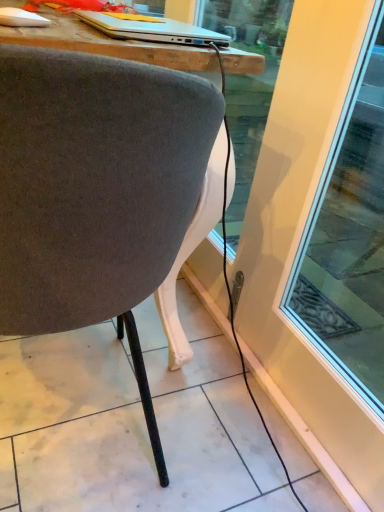
This screenshot has height=512, width=384. What do you see at coordinates (95, 190) in the screenshot?
I see `velvet gray chair at center` at bounding box center [95, 190].

In order to face velvet gray chair at center, should I rotate leftwards or rightwards?

You should look left and rotate roughly 14.360 degrees.

What is the approximate height of velvet gray chair at center?

It is 32.37 inches.

Find the location of `velvet gray chair at center`. velvet gray chair at center is located at coordinates (95, 190).

The width and height of the screenshot is (384, 512). What do you see at coordinates (151, 29) in the screenshot? I see `silver metallic laptop at upper center` at bounding box center [151, 29].

This screenshot has height=512, width=384. I want to click on silver metallic laptop at upper center, so click(x=151, y=29).

You are a GUI agent. You are given a task and a screenshot of the screen. Output one action in this format:
    pyautogui.click(x=<x>, y=<y>)
    Task: Click on the velvet gray chair at center
    
    Given the screenshot: What is the action you would take?
    pyautogui.click(x=95, y=190)

Is velvet gray chair at center to the right of silver metallic laptop at upper center from the viewer's perspective?

No, velvet gray chair at center is not to the right of silver metallic laptop at upper center.

Is velvet gray chair at center positioned in front of silver metallic laptop at upper center?

Yes, the depth of velvet gray chair at center is less than that of silver metallic laptop at upper center.

Between point (101, 146) and point (141, 21), which one is positioned in front?

Positioned in front is point (101, 146).

From the image's perspective, who appears lower, velvet gray chair at center or silver metallic laptop at upper center?

velvet gray chair at center is shown below in the image.

From a real-world perspective, which object stands above the other?

From a 3D spatial view, silver metallic laptop at upper center is above.

Looking at their sizes, would you say velvet gray chair at center is wider or thinner than silver metallic laptop at upper center?

In the image, velvet gray chair at center appears to be wider than silver metallic laptop at upper center.

Who is shorter, velvet gray chair at center or silver metallic laptop at upper center?

With less height is silver metallic laptop at upper center.

Which of these two, velvet gray chair at center or silver metallic laptop at upper center, is bigger?

With larger size is velvet gray chair at center.

Is velvet gray chair at center inside the boundaries of silver metallic laptop at upper center, or outside?

velvet gray chair at center is outside silver metallic laptop at upper center.

Is velvet gray chair at center not near silver metallic laptop at upper center?

velvet gray chair at center is actually quite close to silver metallic laptop at upper center.

Is velvet gray chair at center looking in the opposite direction of silver metallic laptop at upper center?

No, velvet gray chair at center is not facing away from silver metallic laptop at upper center.

At what (x,y) coordinates should I click in order to perform the action: click on laptop on the right of velvet gray chair at center. Please return your answer as a coordinate pair (x, y). This screenshot has width=384, height=512. Looking at the image, I should click on (151, 29).

Is silver metallic laptop at upper center to the left of velvet gray chair at center from the viewer's perspective?

In fact, silver metallic laptop at upper center is to the right of velvet gray chair at center.

Which is in front, silver metallic laptop at upper center or velvet gray chair at center?

velvet gray chair at center is more forward.

Which point is more distant from viewer, (137, 25) or (163, 216)?

Positioned behind is point (137, 25).

From the image's perspective, which is above, silver metallic laptop at upper center or velvet gray chair at center?

From the image's view, silver metallic laptop at upper center is above.

From a real-world perspective, which object stands above the other?

silver metallic laptop at upper center.

Is silver metallic laptop at upper center wider or thinner than velvet gray chair at center?

Considering their sizes, silver metallic laptop at upper center looks slimmer than velvet gray chair at center.

Who is taller, silver metallic laptop at upper center or velvet gray chair at center?

With more height is velvet gray chair at center.

Does silver metallic laptop at upper center have a smaller size compared to velvet gray chair at center?

Indeed, silver metallic laptop at upper center has a smaller size compared to velvet gray chair at center.

Is silver metallic laptop at upper center not within velvet gray chair at center?

That's incorrect, silver metallic laptop at upper center is not completely outside velvet gray chair at center.

Is silver metallic laptop at upper center placed right next to velvet gray chair at center?

No, silver metallic laptop at upper center is not making contact with velvet gray chair at center.

Is silver metallic laptop at upper center aimed at velvet gray chair at center?

Yes, silver metallic laptop at upper center faces towards velvet gray chair at center.

How different are the orientations of silver metallic laptop at upper center and velvet gray chair at center in degrees?

They differ by 90 degrees in their facing directions.

How distant is silver metallic laptop at upper center from velvet gray chair at center?

silver metallic laptop at upper center is 15.27 inches away from velvet gray chair at center.

Where is `chair lying in front of the silver metallic laptop at upper center`? This screenshot has height=512, width=384. chair lying in front of the silver metallic laptop at upper center is located at coordinates (95, 190).

The image size is (384, 512). What are the coordinates of `laptop that is above the velvet gray chair at center (from a real-world perspective)` in the screenshot? It's located at (151, 29).

I want to click on chair in front of the silver metallic laptop at upper center, so click(95, 190).